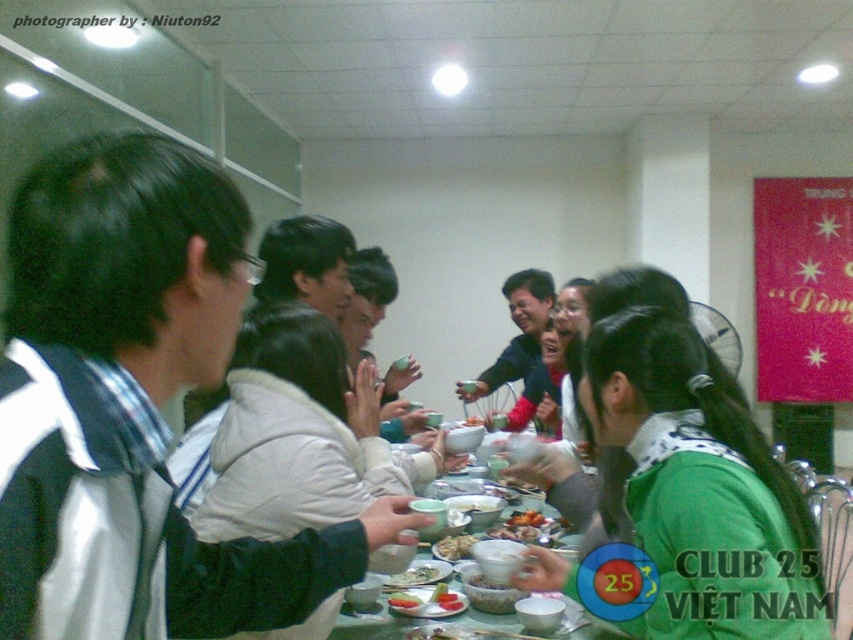
Question: Which point is farther to the camera?

Choices:
 (A) (401, 595)
 (B) (682, 378)
 (C) (439, 548)

Answer: (C)

Question: Can you confirm if green glossy table at center is bigger than smooth white rice bowl at center?

Choices:
 (A) no
 (B) yes

Answer: (B)

Question: Is green matte shirt at center thinner than smooth white rice bowl at center?

Choices:
 (A) yes
 (B) no

Answer: (B)

Question: Which point is farther from the camera taking this photo?

Choices:
 (A) (635, 486)
 (B) (467, 545)
 (C) (486, 531)
 (D) (401, 596)

Answer: (C)

Question: Considering the real-world distances, which object is farthest from the smooth white bowl at center?

Choices:
 (A) smooth white rice bowl at center
 (B) green matte shirt at center

Answer: (B)

Question: Is green glossy table at center to the left of smooth white bowl at center from the viewer's perspective?

Choices:
 (A) no
 (B) yes

Answer: (A)